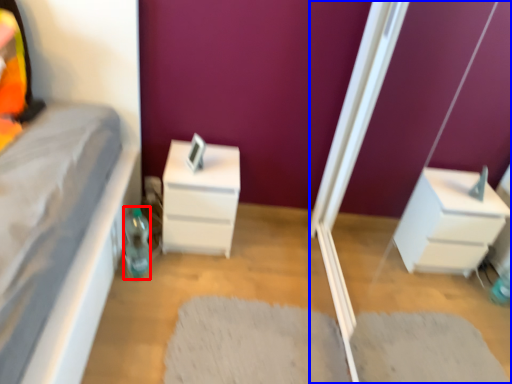
Question: Among these objects, which one is nearest to the camera, bottle (highlighted by a red box) or screen door (highlighted by a blue box)?

Choices:
 (A) bottle
 (B) screen door

Answer: (B)